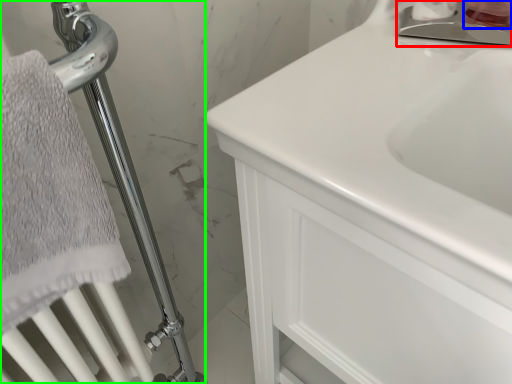
Question: Based on their relative distances, which object is nearer to faucet (highlighted by a red box)? Choose from toiletry (highlighted by a blue box) and shower (highlighted by a green box).

Choices:
 (A) toiletry
 (B) shower

Answer: (A)